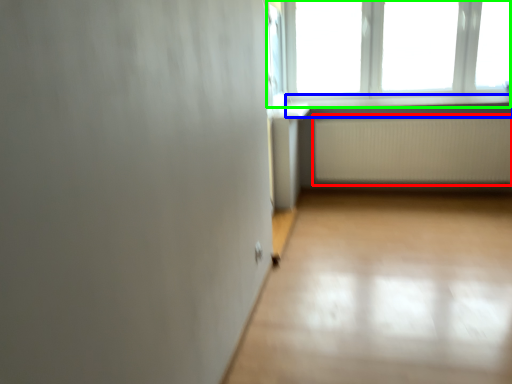
Question: Which is nearer to the radiator (highlighted by a red box)? window sill (highlighted by a blue box) or window (highlighted by a green box).

Choices:
 (A) window sill
 (B) window

Answer: (A)